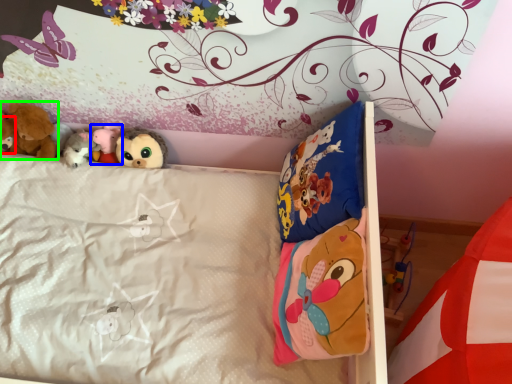
Question: Estimate the real-world distances between objects in this image. Which object is closer to toy (highlighted by a red box), toy (highlighted by a blue box) or toy (highlighted by a green box)?

Choices:
 (A) toy
 (B) toy

Answer: (B)